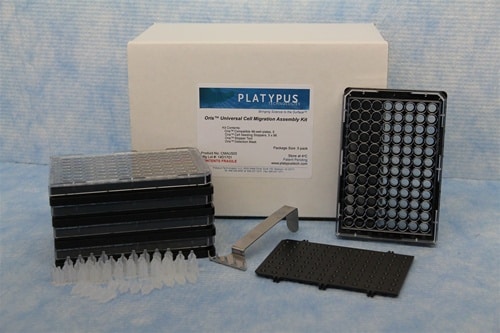
At what (x,y) coordinates should I click in order to perform the action: click on box. Please return your answer as a coordinate pair (x, y). The width and height of the screenshot is (500, 333). Looking at the image, I should click on (297, 75).